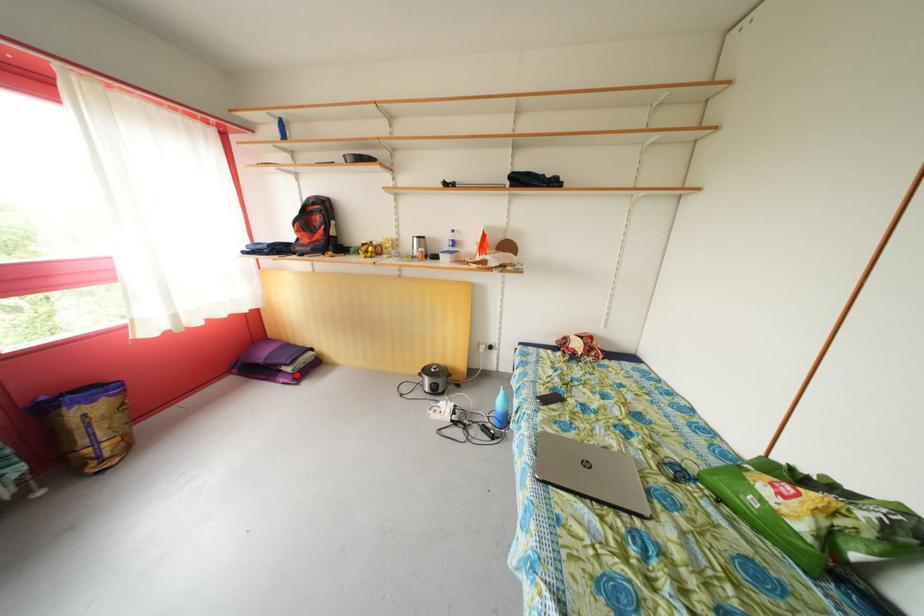
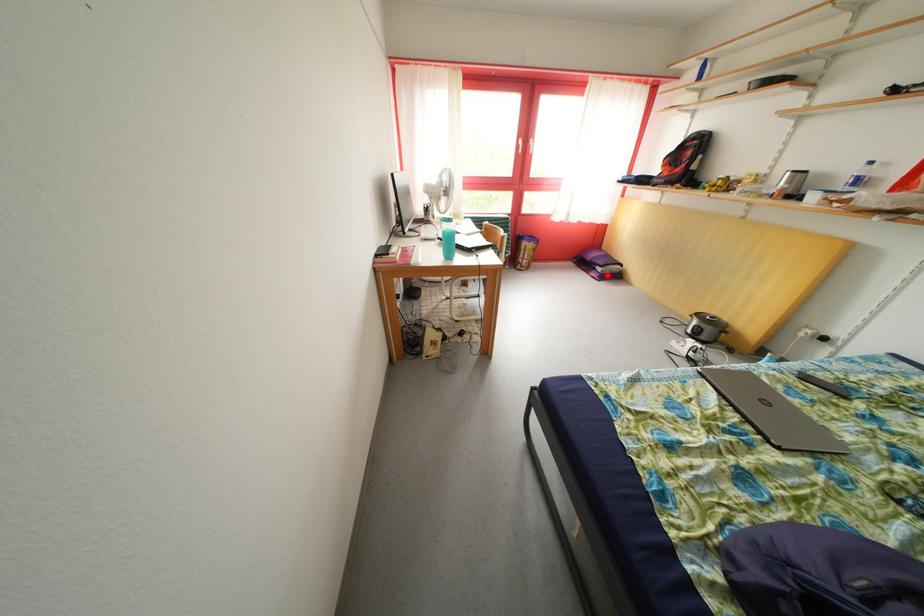
I am providing you with two images of the same scene from different viewpoints. A red point is marked on the first image and another point is marked on the second image. Do the highlighted points in image1 and image2 indicate the same real-world spot?

Yes